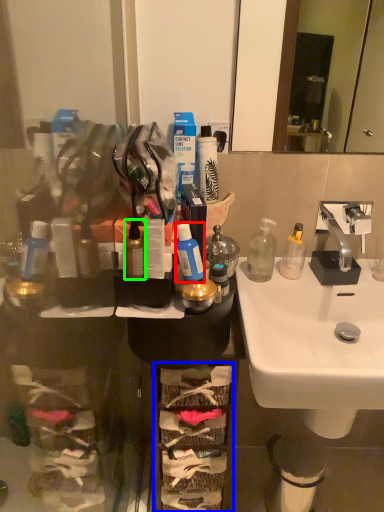
Question: Which object is the closest to the mouthwash (highlighted by a red box)? Choose among these: shelf (highlighted by a blue box) or bottle (highlighted by a green box).

Choices:
 (A) shelf
 (B) bottle

Answer: (B)